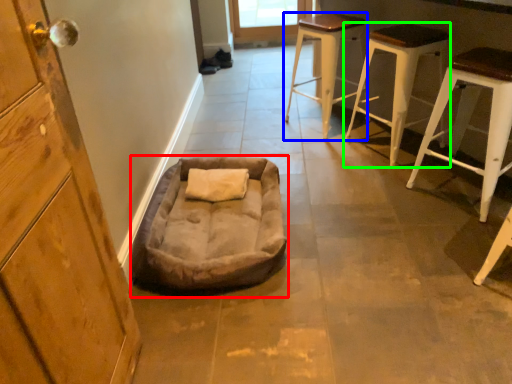
Question: Which is farther away from dog bed (highlighted by a red box)? stool (highlighted by a blue box) or stool (highlighted by a green box)?

Choices:
 (A) stool
 (B) stool

Answer: (A)